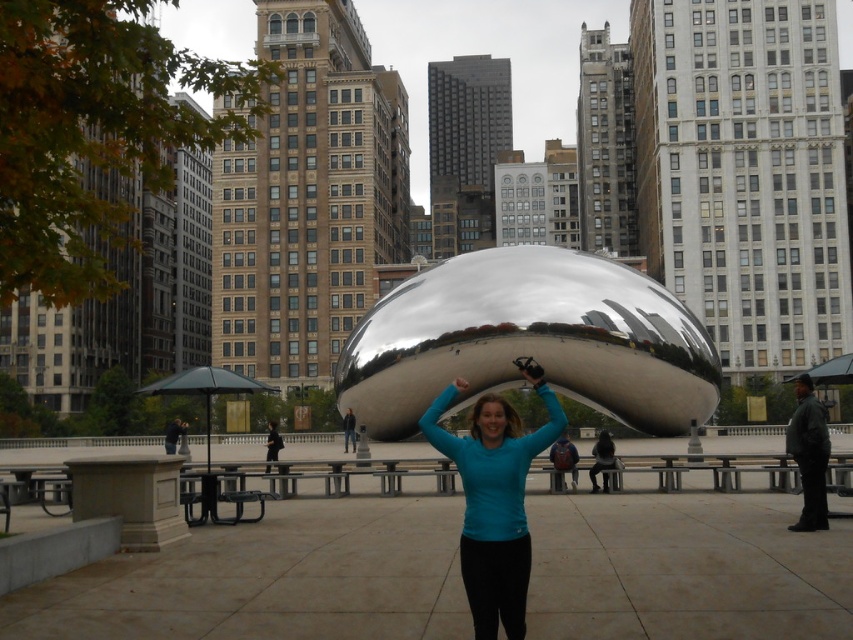
Question: Which of the following is the closest to the observer?

Choices:
 (A) polished metallic sculpture at center
 (B) teal fabric shirt at center
 (C) dark brown hair at center

Answer: (B)

Question: Which point is farther to the camera?

Choices:
 (A) polished metallic sculpture at center
 (B) teal fabric head at center
 (C) teal fabric shirt at center
 (D) dark brown hair at center

Answer: (A)

Question: Is teal fabric head at center above dark brown hair at center?

Choices:
 (A) yes
 (B) no

Answer: (B)

Question: Which object is positioned closest to the teal fabric head at center?

Choices:
 (A) polished metallic sculpture at center
 (B) teal fabric shirt at center

Answer: (B)

Question: Observing the image, what is the correct spatial positioning of teal fabric shirt at center in reference to dark brown hair at center?

Choices:
 (A) left
 (B) right

Answer: (A)

Question: Can you confirm if polished metallic sculpture at center is positioned to the right of dark brown hair at center?

Choices:
 (A) yes
 (B) no

Answer: (B)